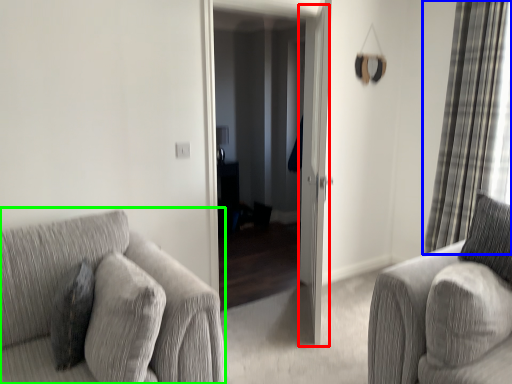
Question: Which object is positioned closest to screen door (highlighted by a red box)? Select from curtain (highlighted by a blue box) and studio couch (highlighted by a green box).

Choices:
 (A) curtain
 (B) studio couch

Answer: (A)